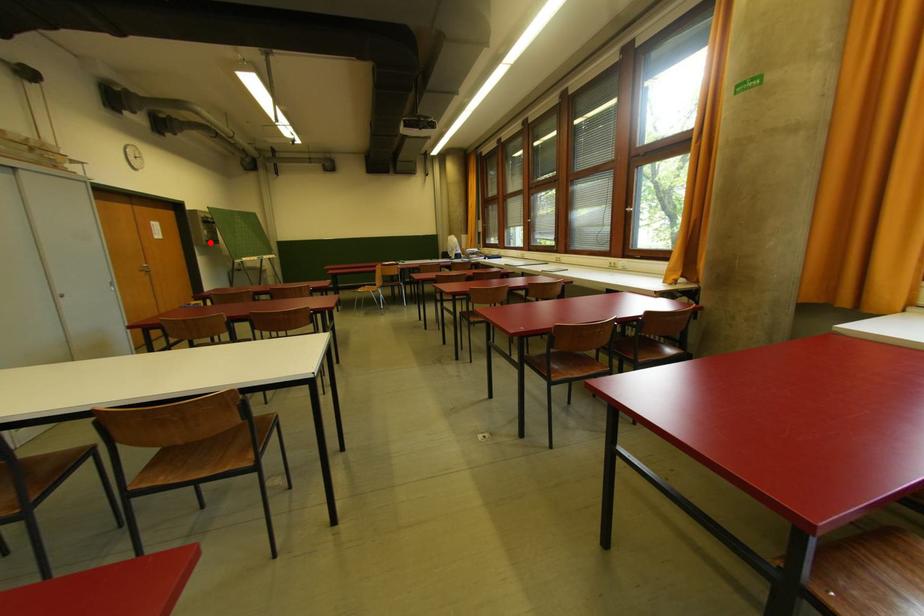
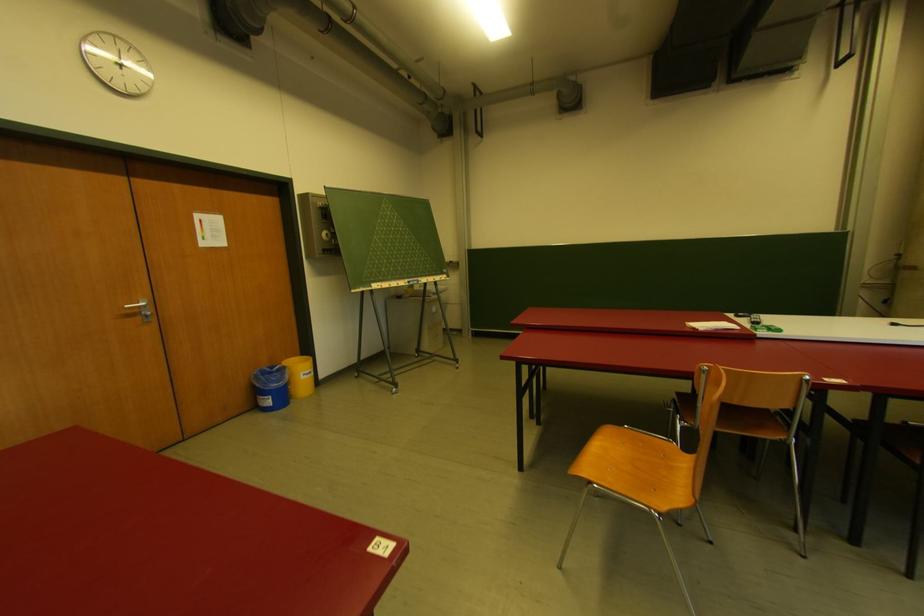
Question: I am providing you with two images of the same scene from different viewpoints. In image1, a red point is highlighted. Considering the same 3D point in image2, which of the following is correct?

Choices:
 (A) It is closer
 (B) It is farther

Answer: (B)